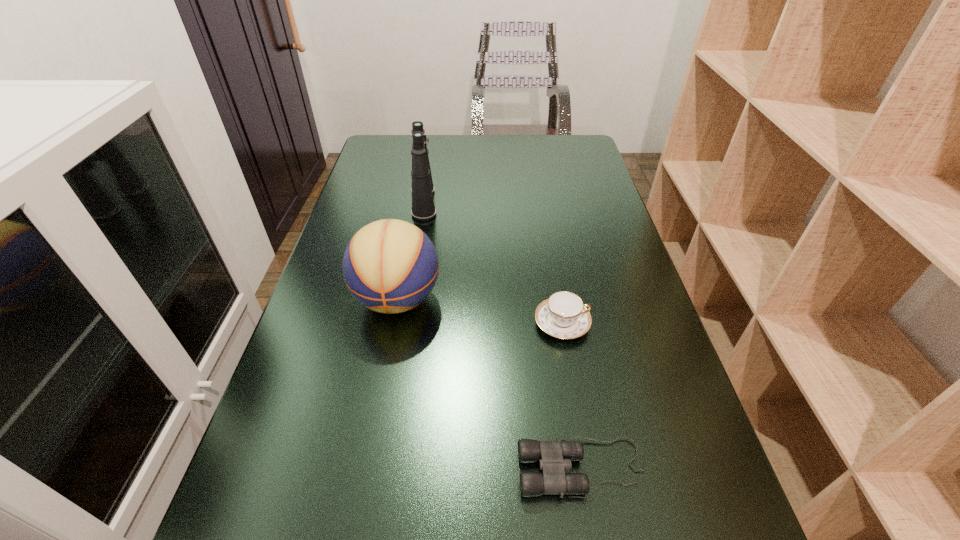
Locate an element on the screen. The image size is (960, 540). vacant space that's between the taller binoculars and the third tallest object is located at coordinates (492, 263).

Where is `free point between the teacup and the basketball`? This screenshot has width=960, height=540. free point between the teacup and the basketball is located at coordinates (480, 312).

This screenshot has height=540, width=960. In order to click on free space between the taller binoculars and the teacup in this screenshot , I will do `click(492, 263)`.

In order to click on free area in between the basketball and the right binoculars in this screenshot , I will do `click(490, 384)`.

The height and width of the screenshot is (540, 960). I want to click on empty space that is in between the second shortest object and the left binoculars, so click(492, 263).

Identify the location of empty space that is in between the basketball and the shortest object. The image size is (960, 540). (490, 384).

In order to click on unoccupied position between the teacup and the basketball in this screenshot , I will do [x=480, y=312].

This screenshot has height=540, width=960. In order to click on vacant space that is in between the right binoculars and the basketball in this screenshot , I will do `click(490, 384)`.

Locate an element on the screen. free area in between the taller binoculars and the second shortest object is located at coordinates (492, 263).

The width and height of the screenshot is (960, 540). Find the location of `blank region between the second shortest object and the right binoculars`. blank region between the second shortest object and the right binoculars is located at coordinates (572, 396).